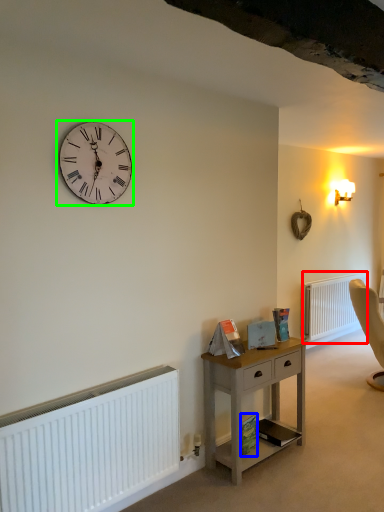
Question: Estimate the real-world distances between objects in this image. Which object is closer to radiator (highlighted by a red box), book (highlighted by a blue box) or wall clock (highlighted by a green box)?

Choices:
 (A) book
 (B) wall clock

Answer: (A)